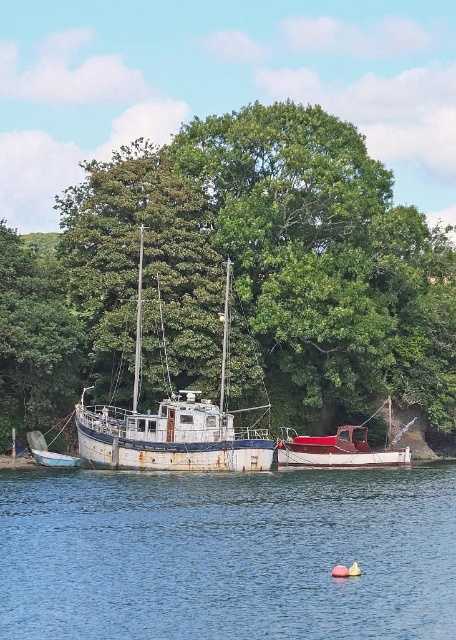
Question: Does green leafy tree at center have a larger size compared to rusty metal boat at center?

Choices:
 (A) no
 (B) yes

Answer: (B)

Question: Does rustic wood boat at center appear under rusty metal boat at lower left?

Choices:
 (A) no
 (B) yes

Answer: (A)

Question: Which point appears farthest from the camera in this image?

Choices:
 (A) (435, 609)
 (B) (103, 436)

Answer: (B)

Question: Which point appears farthest from the camera in this image?

Choices:
 (A) pyautogui.click(x=62, y=467)
 (B) pyautogui.click(x=68, y=204)
 (C) pyautogui.click(x=362, y=456)

Answer: (B)

Question: Can you confirm if blue water at center is positioned to the right of rustic wood boat at center?

Choices:
 (A) yes
 (B) no

Answer: (B)

Question: Estimate the real-world distances between objects in this image. Which object is farther from the rustic wood boat at center?

Choices:
 (A) rusty metal boat at center
 (B) blue water at center
 (C) rusty metal boat at lower left
 (D) green leafy tree at center

Answer: (C)